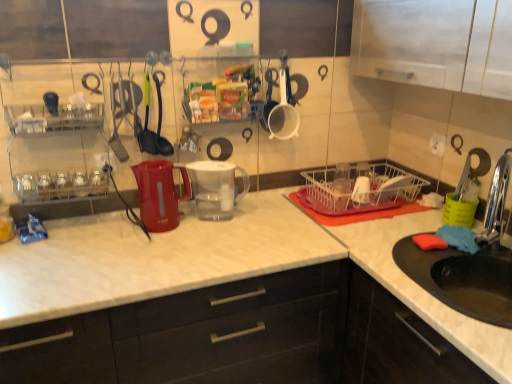
Question: Does matte white countertop at center, the second cabinetry in the right-to-left sequence, appear on the left side of chrome metallic faucet at sink right?

Choices:
 (A) yes
 (B) no

Answer: (A)

Question: Is matte white countertop at center, placed as the 1th cabinetry when sorted from left to right, looking in the opposite direction of chrome metallic faucet at sink right?

Choices:
 (A) no
 (B) yes

Answer: (A)

Question: Is matte white countertop at center, placed as the 1th cabinetry when sorted from left to right, at the right side of chrome metallic faucet at sink right?

Choices:
 (A) no
 (B) yes

Answer: (A)

Question: Does matte white countertop at center, the second cabinetry in the right-to-left sequence, lie in front of chrome metallic faucet at sink right?

Choices:
 (A) no
 (B) yes

Answer: (B)

Question: From a real-world perspective, is matte white countertop at center, placed as the 1th cabinetry when sorted from left to right, positioned over chrome metallic faucet at sink right based on gravity?

Choices:
 (A) no
 (B) yes

Answer: (A)

Question: From the image's perspective, is white matte measuring cup at upper center, acting as the 2th tableware starting from the right, positioned above or below matte plastic kettle at center, acting as the 1th appliance starting from the left?

Choices:
 (A) above
 (B) below

Answer: (A)

Question: Is white matte measuring cup at upper center, which is the 3th tableware from left to right, to the left or to the right of matte plastic kettle at center, acting as the 1th appliance starting from the left, in the image?

Choices:
 (A) right
 (B) left

Answer: (A)

Question: Looking at their shapes, would you say white matte measuring cup at upper center, acting as the 2th tableware starting from the right, is wider or thinner than matte plastic kettle at center, the second appliance when ordered from right to left?

Choices:
 (A) thin
 (B) wide

Answer: (A)

Question: Is white matte measuring cup at upper center, which is the 3th tableware from left to right, in front of or behind matte plastic kettle at center, the second appliance when ordered from right to left, in the image?

Choices:
 (A) behind
 (B) front

Answer: (A)

Question: Considering their positions, is white wire basket at center located in front of or behind green plastic spatula at center, placed as the first tableware when sorted from left to right?

Choices:
 (A) front
 (B) behind

Answer: (B)

Question: Visually, is white wire basket at center positioned to the left or to the right of green plastic spatula at center, which is the fourth tableware in right-to-left order?

Choices:
 (A) right
 (B) left

Answer: (A)

Question: Looking at their shapes, would you say white wire basket at center is wider or thinner than green plastic spatula at center, which is the fourth tableware in right-to-left order?

Choices:
 (A) wide
 (B) thin

Answer: (A)

Question: Is white wire basket at center spatially inside green plastic spatula at center, placed as the first tableware when sorted from left to right, or outside of it?

Choices:
 (A) inside
 (B) outside

Answer: (B)

Question: From their relative heights in the image, would you say green rubber spoon at center, which appears as the 2th tableware when viewed from the left, is taller or shorter than transparent plastic cups at center, which is the 1th tableware in right-to-left order?

Choices:
 (A) short
 (B) tall

Answer: (B)

Question: In the image, is green rubber spoon at center, the third tableware from the right, positioned in front of or behind transparent plastic cups at center, which is the 1th tableware in right-to-left order?

Choices:
 (A) behind
 (B) front

Answer: (B)